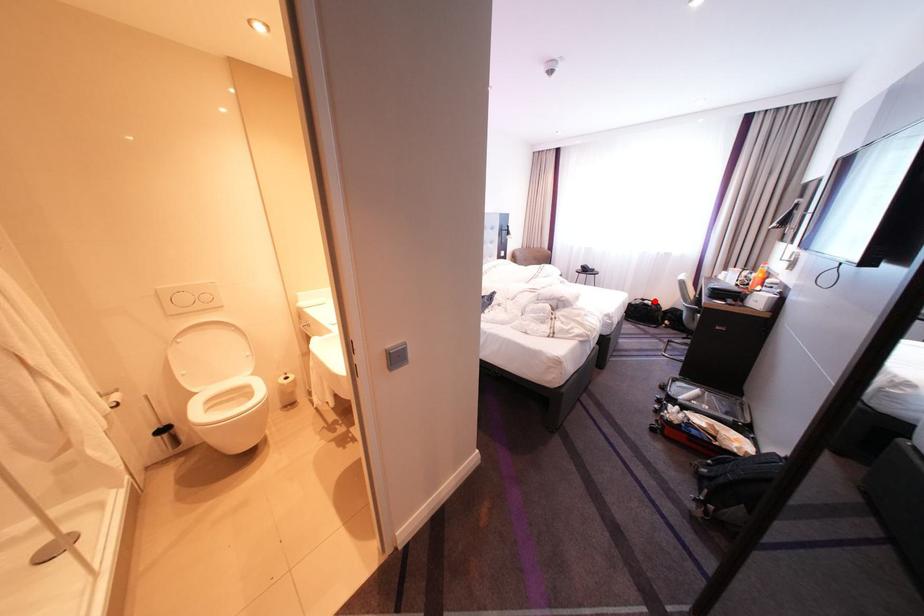
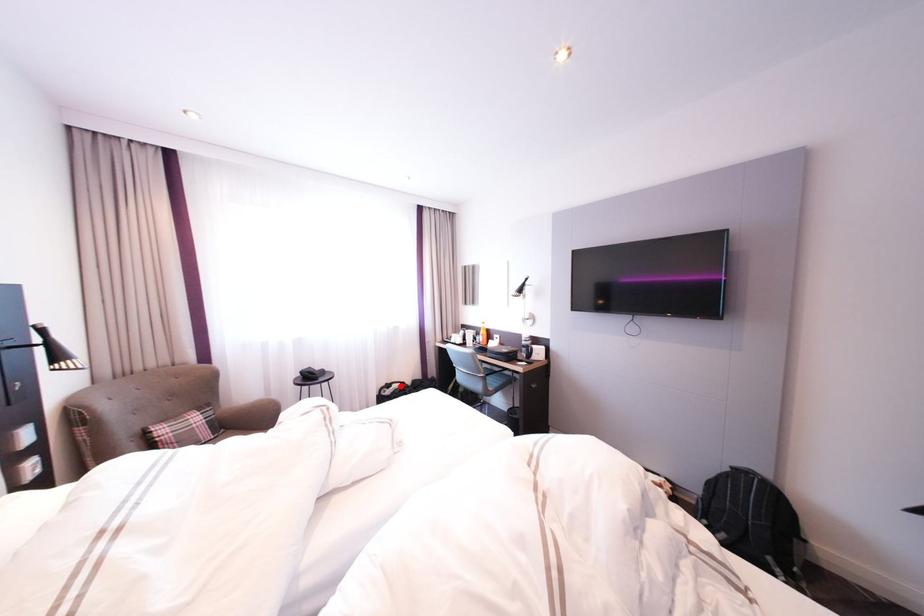
I am providing you with two images of the same scene from different viewpoints. A red point is marked on the first image and another point is marked on the second image. Does the point marked in image1 correspond to the same location as the one in image2?

Yes